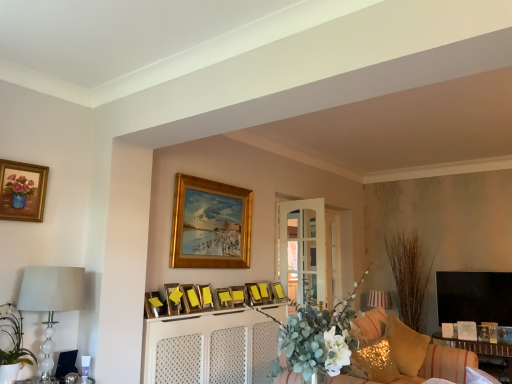
What do you see at coordinates (190, 298) in the screenshot? This screenshot has width=512, height=384. I see `wooden picture frame at center, the eighth picture frame when ordered from right to left` at bounding box center [190, 298].

You are a GUI agent. You are given a task and a screenshot of the screen. Output one action in this format:
    pyautogui.click(x=<x>, y=<y>)
    Task: Click on the white textured cabinet at center
    The image size is (512, 384).
    Given the screenshot: What is the action you would take?
    pyautogui.click(x=209, y=348)

Measure the distance between point (409, 352) and camera.

Point (409, 352) is 11.26 feet from camera.

In order to face wooden picture frame at center, which appears as the third picture frame when viewed from the right, should I rotate leftwards or rightwards?

Rotate left and turn 0.230 degrees.

This screenshot has width=512, height=384. What are the coordinates of `wooden table at lower right` in the screenshot? It's located at (484, 355).

This screenshot has height=384, width=512. In order to click on white glass lamp at left, the 1th lamp positioned from the left in this screenshot , I will do `click(51, 302)`.

The width and height of the screenshot is (512, 384). What are the coordinates of `the 5th picture frame below the wooden picture frame at center, the eighth picture frame when ordered from right to left (from the image's perspective)` in the screenshot? It's located at [x=264, y=292].

Is wooden picture frame at center, the 4th picture frame from the left, spatially inside wooden picture frame at center, arranged as the tenth picture frame when viewed from the left, or outside of it?

wooden picture frame at center, the 4th picture frame from the left, is located beyond the bounds of wooden picture frame at center, arranged as the tenth picture frame when viewed from the left.

Which of these two, wooden picture frame at center, the 4th picture frame from the left, or wooden picture frame at center, the 2th picture frame viewed from the right, stands taller?

wooden picture frame at center, the 4th picture frame from the left.

Is point (183, 289) positioned after point (262, 289)?

No, it is not.

Can you confirm if white textured cabinet at center is positioned to the left of green leafy plant at left?

No, white textured cabinet at center is not to the left of green leafy plant at left.

Where is `plant in front of the white textured cabinet at center`? The width and height of the screenshot is (512, 384). plant in front of the white textured cabinet at center is located at coordinates (12, 344).

Does point (151, 320) appear closer or farther from the camera than point (13, 356)?

Point (151, 320) is farther from the camera than point (13, 356).

Based on their sizes in the image, would you say white glass lamp at left, acting as the 1th lamp starting from the top, is bigger or smaller than gold wooden picture frame at upper center, which appears as the sixth picture frame when viewed from the left?

Considering their sizes, white glass lamp at left, acting as the 1th lamp starting from the top, takes up more space than gold wooden picture frame at upper center, which appears as the sixth picture frame when viewed from the left.

Does white glass lamp at left, positioned as the 2th lamp in back-to-front order, have a greater height compared to gold wooden picture frame at upper center, which appears as the sixth picture frame when viewed from the left?

Incorrect, the height of white glass lamp at left, positioned as the 2th lamp in back-to-front order, is not larger of that of gold wooden picture frame at upper center, which appears as the sixth picture frame when viewed from the left.

Considering the relative positions of white glass lamp at left, positioned as the 2th lamp in back-to-front order, and gold wooden picture frame at upper center, which is the 6th picture frame in right-to-left order, in the image provided, is white glass lamp at left, positioned as the 2th lamp in back-to-front order, to the left or to the right of gold wooden picture frame at upper center, which is the 6th picture frame in right-to-left order,?

From the image, it's evident that white glass lamp at left, positioned as the 2th lamp in back-to-front order, is to the left of gold wooden picture frame at upper center, which is the 6th picture frame in right-to-left order.

From a real-world perspective, is wooden picture frame at center, placed as the tenth picture frame when sorted from right to left, below white textured cabinet at center?

No, from a real-world perspective, wooden picture frame at center, placed as the tenth picture frame when sorted from right to left, is not beneath white textured cabinet at center.

Is white textured cabinet at center at the back of wooden picture frame at center, placed as the tenth picture frame when sorted from right to left?

No, wooden picture frame at center, placed as the tenth picture frame when sorted from right to left,'s orientation is not away from white textured cabinet at center.

Is wooden picture frame at center, placed as the tenth picture frame when sorted from right to left, inside or outside of white textured cabinet at center?

wooden picture frame at center, placed as the tenth picture frame when sorted from right to left, lies outside white textured cabinet at center.

From the picture: Between wooden picture frame at center, which is the 2th picture frame from left to right, and white textured cabinet at center, which one appears on the right side from the viewer's perspective?

Positioned to the right is white textured cabinet at center.

Is matte yellow picture frame at center, which is the seventh picture frame from left to right, positioned with its back to wooden picture frame at center, the eighth picture frame when ordered from right to left?

No, matte yellow picture frame at center, which is the seventh picture frame from left to right, is not facing away from wooden picture frame at center, the eighth picture frame when ordered from right to left.

From the picture: What's the angular difference between matte yellow picture frame at center, which is the seventh picture frame from left to right, and wooden picture frame at center, the 4th picture frame from the left,'s facing directions?

The angular difference between matte yellow picture frame at center, which is the seventh picture frame from left to right, and wooden picture frame at center, the 4th picture frame from the left, is 9.01 degrees.

From the image's perspective, is matte yellow picture frame at center, which is the seventh picture frame from left to right, positioned above or below wooden picture frame at center, the 4th picture frame from the left?

From the image's perspective, matte yellow picture frame at center, which is the seventh picture frame from left to right, appears below wooden picture frame at center, the 4th picture frame from the left.

Considering the sizes of objects matte yellow picture frame at center, positioned as the 5th picture frame in right-to-left order, and wooden picture frame at center, the 4th picture frame from the left, in the image provided, who is wider, matte yellow picture frame at center, positioned as the 5th picture frame in right-to-left order, or wooden picture frame at center, the 4th picture frame from the left,?

wooden picture frame at center, the 4th picture frame from the left.

From the image's perspective, does wooden picture frame at center, the ninth picture frame when ordered from right to left, appear lower than matte yellow picture frame at center, positioned as the 5th picture frame in right-to-left order?

Incorrect, from the image's perspective, wooden picture frame at center, the ninth picture frame when ordered from right to left, is higher than matte yellow picture frame at center, positioned as the 5th picture frame in right-to-left order.

Considering the relative positions of wooden picture frame at center, the 3th picture frame positioned from the left, and matte yellow picture frame at center, positioned as the 5th picture frame in right-to-left order, in the image provided, is wooden picture frame at center, the 3th picture frame positioned from the left, to the left of matte yellow picture frame at center, positioned as the 5th picture frame in right-to-left order, from the viewer's perspective?

Yes, wooden picture frame at center, the 3th picture frame positioned from the left, is to the left of matte yellow picture frame at center, positioned as the 5th picture frame in right-to-left order.

From the picture: Based on their sizes in the image, would you say wooden picture frame at center, the 3th picture frame positioned from the left, is bigger or smaller than matte yellow picture frame at center, positioned as the 5th picture frame in right-to-left order?

In the image, wooden picture frame at center, the 3th picture frame positioned from the left, appears to be larger than matte yellow picture frame at center, positioned as the 5th picture frame in right-to-left order.

Considering the relative positions of wooden picture frame at center, the 3th picture frame positioned from the left, and matte yellow picture frame at center, positioned as the 5th picture frame in right-to-left order, in the image provided, is wooden picture frame at center, the 3th picture frame positioned from the left, in front of matte yellow picture frame at center, positioned as the 5th picture frame in right-to-left order,?

Yes, wooden picture frame at center, the 3th picture frame positioned from the left, is closer to the camera.

Which object is positioned more to the right, gold glittery pillow at lower right, positioned as the first pillow in back-to-front order, or gold wooden picture frame at upper center, which appears as the sixth picture frame when viewed from the left?

gold glittery pillow at lower right, positioned as the first pillow in back-to-front order, is more to the right.

Between gold glittery pillow at lower right, arranged as the 2th pillow when viewed from the front, and gold wooden picture frame at upper center, which is the 6th picture frame in right-to-left order, which one is positioned behind?

gold wooden picture frame at upper center, which is the 6th picture frame in right-to-left order.

What's the angular difference between gold glittery pillow at lower right, positioned as the first pillow in back-to-front order, and gold wooden picture frame at upper center, which appears as the sixth picture frame when viewed from the left,'s facing directions?

They differ by 35.6 degrees in their facing directions.

Looking at this image, from the image's perspective, between gold glittery pillow at lower right, positioned as the first pillow in back-to-front order, and gold wooden picture frame at upper center, which is the 6th picture frame in right-to-left order, who is located below?

gold glittery pillow at lower right, positioned as the first pillow in back-to-front order, appears lower in the image.

Where is `picture frame that is the 5th one when counting upward from the wooden picture frame at center, the 2th picture frame viewed from the right (from the image's perspective)`? Image resolution: width=512 pixels, height=384 pixels. picture frame that is the 5th one when counting upward from the wooden picture frame at center, the 2th picture frame viewed from the right (from the image's perspective) is located at coordinates (190, 298).

Find the location of `entertainment center behind the green leafy plant at left`. entertainment center behind the green leafy plant at left is located at coordinates [209, 348].

From the image, which object appears to be farther from white textured cabinet at center, wooden picture frame at center, the 11th picture frame viewed from the left, or matte gold picture frame at upper left, the 1th picture frame viewed from the left?

matte gold picture frame at upper left, the 1th picture frame viewed from the left, lies further to white textured cabinet at center than the other object.

Considering their positions, is matte gold picture frame at upper left, the 1th picture frame viewed from the left, positioned closer to gold wooden picture frame at upper center, which appears as the sixth picture frame when viewed from the left, than wooden picture frame at center, the 4th picture frame from the left?

The object closer to gold wooden picture frame at upper center, which appears as the sixth picture frame when viewed from the left, is wooden picture frame at center, the 4th picture frame from the left.

From the image, which object appears to be farther from matte yellow picture frame at center, positioned as the 5th picture frame in right-to-left order, white glass lamp at left, marked as the 1th lamp in a front-to-back arrangement, or white textured cabinet at center?

Based on the image, white glass lamp at left, marked as the 1th lamp in a front-to-back arrangement, appears to be further to matte yellow picture frame at center, positioned as the 5th picture frame in right-to-left order.

Based on their spatial positions, is white matte floral arrangement at center or white textured cabinet at center further from gold glittery pillow at lower right, positioned as the first pillow in back-to-front order?

white matte floral arrangement at center.

When comparing their distances from wooden picture frame at center, which is the 2th picture frame from left to right, does white glass lamp at left, which appears as the second lamp when viewed from the right, or wooden picture frame at center, arranged as the tenth picture frame when viewed from the left, seem closer?

Based on the image, white glass lamp at left, which appears as the second lamp when viewed from the right, appears to be nearer to wooden picture frame at center, which is the 2th picture frame from left to right.

From the picture: Which object lies nearer to the anchor point white glass lamp at left, arranged as the 2th lamp when ordered from the bottom, matte gold picture frame at upper left, the 1th picture frame viewed from the left, or wooden picture frame at center, which is the 2th picture frame from left to right?

matte gold picture frame at upper left, the 1th picture frame viewed from the left, lies closer to white glass lamp at left, arranged as the 2th lamp when ordered from the bottom, than the other object.

When comparing their distances from white matte floral arrangement at center, does wooden picture frame at center, the 4th picture frame from the left, or wooden table at lower right seem closer?

wooden picture frame at center, the 4th picture frame from the left.

Looking at the image, which one is located closer to wooden picture frame at center, the 1th picture frame when ordered from right to left, wooden picture frame at center, the 2th picture frame viewed from the right, or white matte floral arrangement at center?

The object closer to wooden picture frame at center, the 1th picture frame when ordered from right to left, is wooden picture frame at center, the 2th picture frame viewed from the right.

Locate an element on the screen. entertainment center positioned between white glass lamp at left, arranged as the 2th lamp when ordered from the bottom, and wooden picture frame at center, the 2th picture frame viewed from the right, from near to far is located at coordinates (209, 348).

Find the location of a particular element. The width and height of the screenshot is (512, 384). entertainment center located between white glass lamp at left, which appears as the second lamp when viewed from the right, and wooden picture frame at center, the eighth picture frame when ordered from right to left, in the depth direction is located at coordinates (209, 348).

Identify the location of pillow between wooden picture frame at center, arranged as the tenth picture frame when viewed from the left, and gold glittery pillow at lower right, positioned as the first pillow in back-to-front order. The image size is (512, 384). (374, 362).

Where is `entertainment center between wooden picture frame at center, positioned as the seventh picture frame in right-to-left order, and gold sequined pillow at lower right, which is the second pillow in back-to-front order, in the horizontal direction`? The height and width of the screenshot is (384, 512). entertainment center between wooden picture frame at center, positioned as the seventh picture frame in right-to-left order, and gold sequined pillow at lower right, which is the second pillow in back-to-front order, in the horizontal direction is located at coordinates (209, 348).